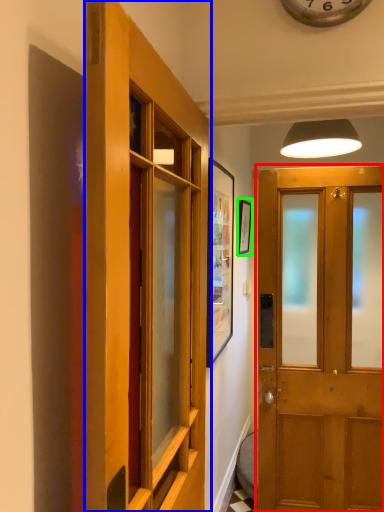
Question: Considering the real-world distances, which object is farthest from door (highlighted by a red box)? door (highlighted by a blue box) or picture frame (highlighted by a green box)?

Choices:
 (A) door
 (B) picture frame

Answer: (A)